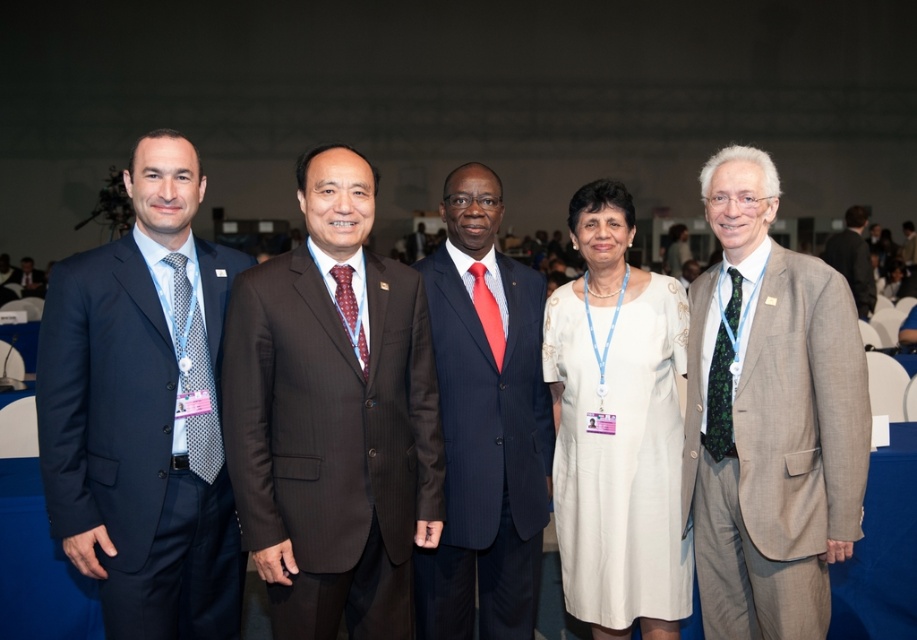
You are organizing a photo shoot and need to arrange the light brown wool suit at right and the dark blue pinstripe suit at center in a row from left to right. Based on their current positions, what order should they be placed in?

The light brown wool suit at right is positioned on the right side of dark blue pinstripe suit at center, so the correct order from left to right would be dark blue pinstripe suit at center followed by light brown wool suit at right.

You are a photographer at the event and need to adjust the lighting so that both the light brown wool suit at right and the dark brown suit at center are equally visible. Which suit requires more light adjustment to ensure visibility?

The light brown wool suit at right might be wider than the dark brown suit at center, so it may require more light adjustment to ensure visibility.

You are standing at the back of the room and want to take a photo of the group. The two points in the image, point (741, 608) and point (569, 488), are part of the group. Which point should you focus on to ensure the person at that point is in sharp focus?

You should focus on point (741, 608) because it is closer to the camera than point (569, 488), so it will be in sharp focus.